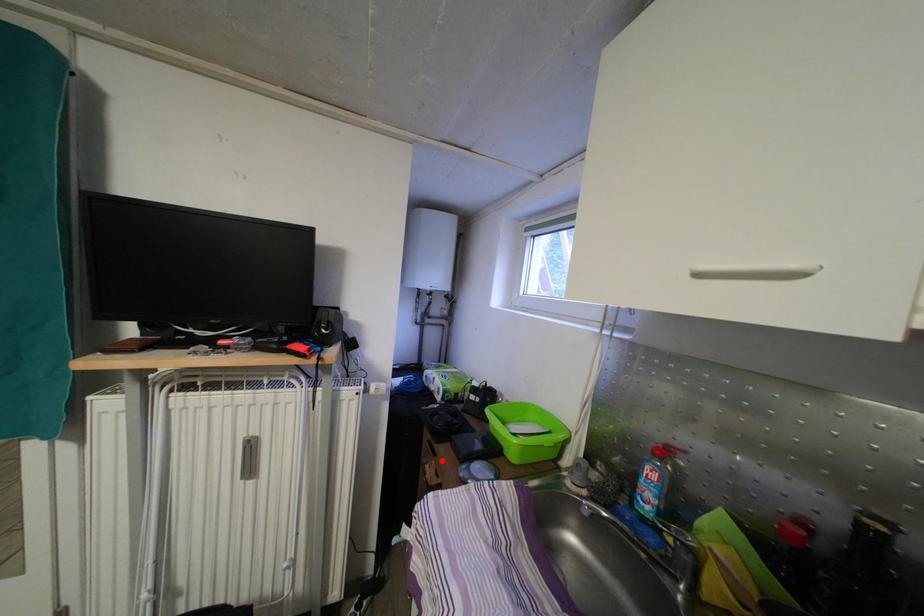
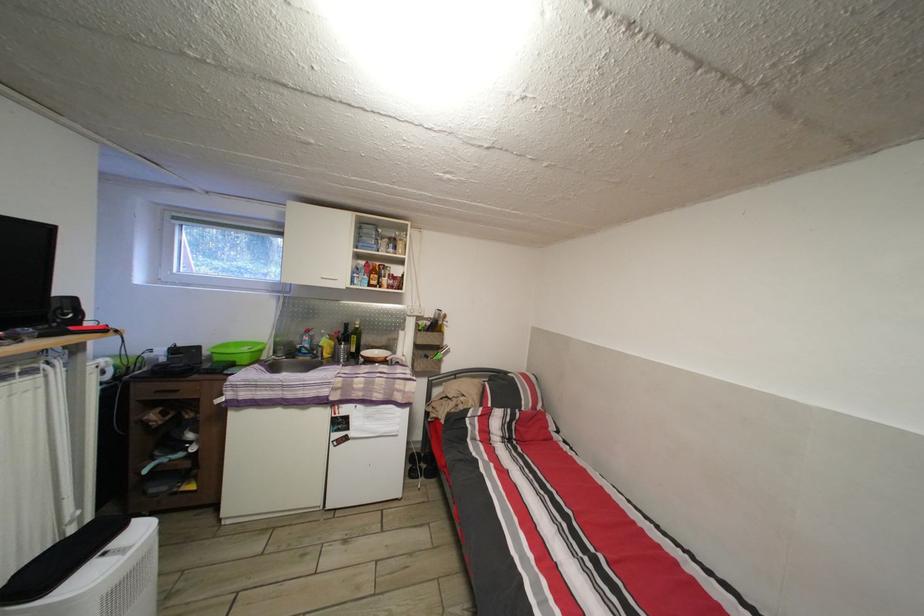
Locate, in the second image, the point that corresponds to the highlighted location in the first image.

(184, 398)